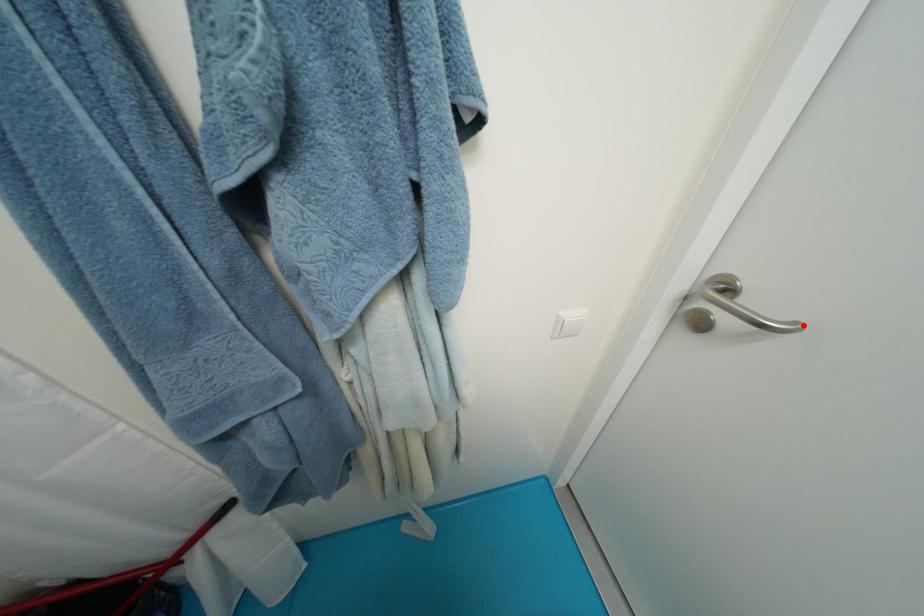
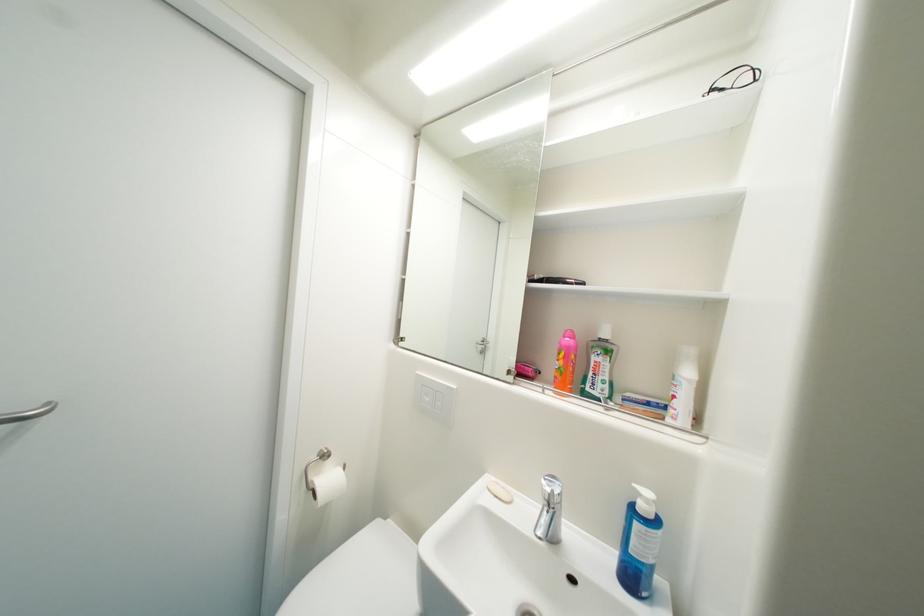
Where in the second image is the point corresponding to the highlighted location from the first image?

(55, 405)